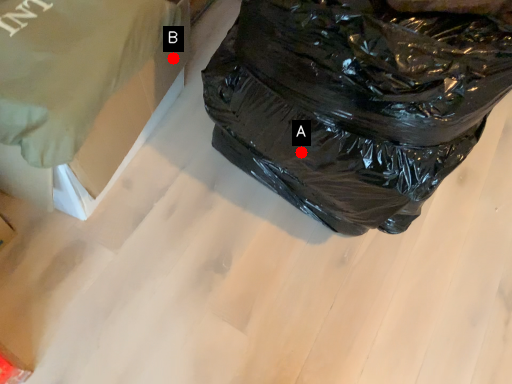
Question: Two points are circled on the image, labeled by A and B beside each circle. Which point is closer to the camera?

Choices:
 (A) A is closer
 (B) B is closer

Answer: (A)